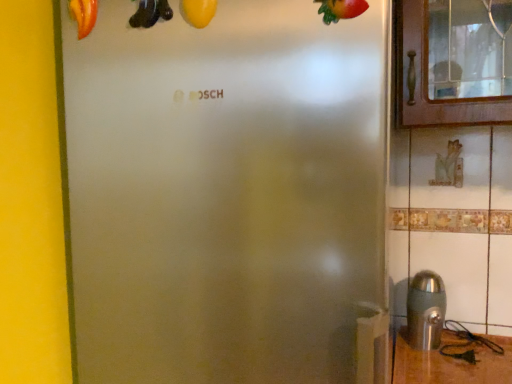
Question: Are yellow matte squash at upper center, marked as the second fruit in a right-to-left arrangement, and yellow matte banana at upper center far apart?

Choices:
 (A) yes
 (B) no

Answer: (B)

Question: Is the depth of yellow matte squash at upper center, which appears as the 2th fruit when viewed from the front, greater than that of yellow matte banana at upper center?

Choices:
 (A) yes
 (B) no

Answer: (B)

Question: From a real-world perspective, is yellow matte squash at upper center, the 2th fruit in the left-to-right sequence, beneath yellow matte banana at upper center?

Choices:
 (A) yes
 (B) no

Answer: (A)

Question: Is yellow matte squash at upper center, positioned as the 2th fruit in back-to-front order, at the right side of yellow matte banana at upper center?

Choices:
 (A) yes
 (B) no

Answer: (A)

Question: From the image's perspective, is yellow matte squash at upper center, marked as the second fruit in a right-to-left arrangement, above yellow matte banana at upper center?

Choices:
 (A) yes
 (B) no

Answer: (B)

Question: Considering the relative sizes of yellow matte squash at upper center, the 2th fruit in the left-to-right sequence, and yellow matte banana at upper center in the image provided, is yellow matte squash at upper center, the 2th fruit in the left-to-right sequence, shorter than yellow matte banana at upper center?

Choices:
 (A) yes
 (B) no

Answer: (B)

Question: Is shiny red strawberry at upper right, arranged as the third fruit when viewed from the back, outside of yellow matte squash at upper center, positioned as the 2th fruit in back-to-front order?

Choices:
 (A) yes
 (B) no

Answer: (A)

Question: Is shiny red strawberry at upper right, arranged as the third fruit when viewed from the back, facing away from yellow matte squash at upper center, marked as the second fruit in a right-to-left arrangement?

Choices:
 (A) yes
 (B) no

Answer: (B)

Question: Does shiny red strawberry at upper right, arranged as the third fruit when viewed from the back, have a lesser height compared to yellow matte squash at upper center, the 2th fruit in the left-to-right sequence?

Choices:
 (A) no
 (B) yes

Answer: (B)

Question: Would you say yellow matte squash at upper center, which appears as the 2th fruit when viewed from the front, is part of shiny red strawberry at upper right, marked as the first fruit in a right-to-left arrangement,'s contents?

Choices:
 (A) no
 (B) yes

Answer: (A)

Question: From the image's perspective, is shiny red strawberry at upper right, marked as the first fruit in a right-to-left arrangement, beneath yellow matte squash at upper center, positioned as the 2th fruit in back-to-front order?

Choices:
 (A) no
 (B) yes

Answer: (B)

Question: Considering the relative sizes of shiny red strawberry at upper right, which is the 3th fruit from left to right, and yellow matte squash at upper center, positioned as the 2th fruit in back-to-front order, in the image provided, is shiny red strawberry at upper right, which is the 3th fruit from left to right, taller than yellow matte squash at upper center, positioned as the 2th fruit in back-to-front order,?

Choices:
 (A) no
 (B) yes

Answer: (A)

Question: Is matte red tomato at upper left, positioned as the 1th fruit in left-to-right order, not inside stainless steel at lower right?

Choices:
 (A) no
 (B) yes

Answer: (B)